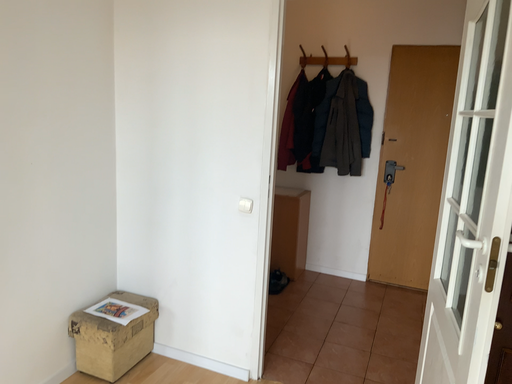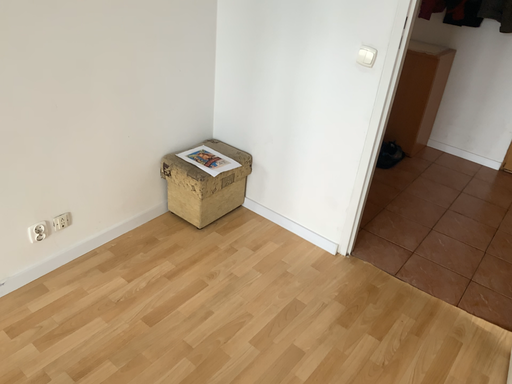
Question: How did the camera likely rotate when shooting the video?

Choices:
 (A) rotated left
 (B) rotated right

Answer: (A)